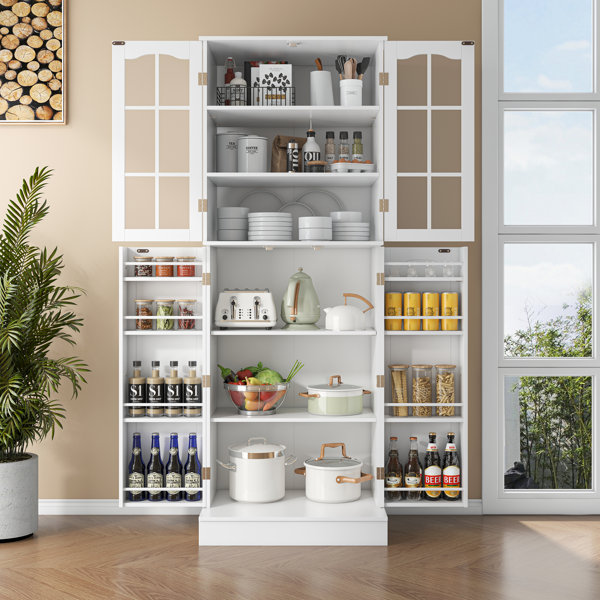
You are a GUI agent. You are given a task and a screenshot of the screen. Output one action in this format:
    pyautogui.click(x=<x>, y=<y>)
    Task: Click on the plates
    The width and height of the screenshot is (600, 600).
    Given the screenshot: What is the action you would take?
    pyautogui.click(x=356, y=238), pyautogui.click(x=346, y=234), pyautogui.click(x=345, y=227), pyautogui.click(x=346, y=224), pyautogui.click(x=270, y=239), pyautogui.click(x=268, y=234), pyautogui.click(x=268, y=228), pyautogui.click(x=268, y=223), pyautogui.click(x=268, y=219), pyautogui.click(x=269, y=216)